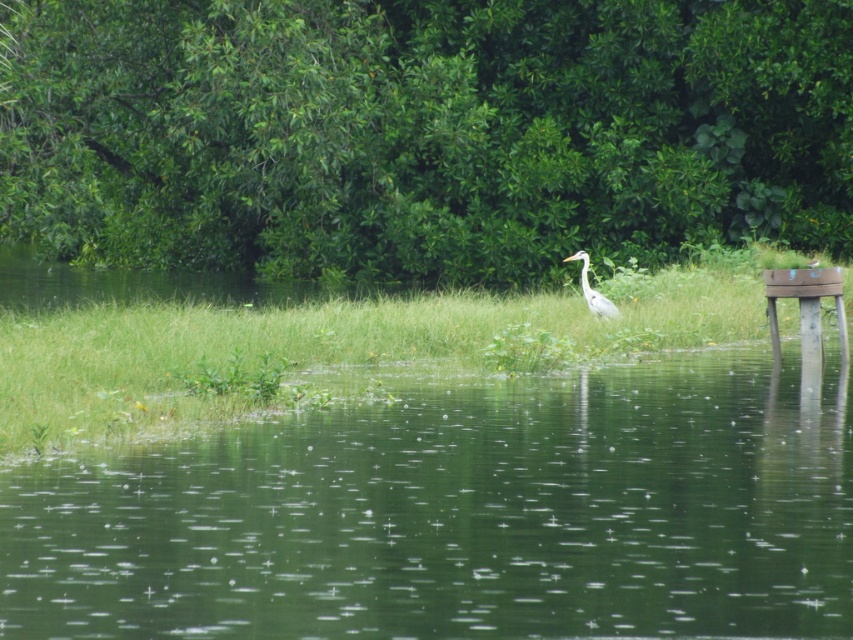
From the picture: Between green leafy tree at center and green grass at center, which one has less height?

green grass at center is shorter.

Is green leafy tree at center bigger than green grass at center?

Correct, green leafy tree at center is larger in size than green grass at center.

This screenshot has height=640, width=853. I want to click on green leafy tree at center, so click(422, 132).

Does green grass at center lie in front of white smooth heron at center?

Yes, green grass at center is in front of white smooth heron at center.

Does green grass at center appear on the left side of white smooth heron at center?

Correct, you'll find green grass at center to the left of white smooth heron at center.

From the picture: Who is more forward, (189,330) or (593,291)?

Point (189,330) is in front.

You are a GUI agent. You are given a task and a screenshot of the screen. Output one action in this format:
    pyautogui.click(x=<x>, y=<y>)
    Task: Click on the green grass at center
    The image size is (853, 640).
    Given the screenshot: What is the action you would take?
    click(328, 349)

Is green leafy tree at center behind white smooth heron at center?

Yes, it is behind white smooth heron at center.

Can you confirm if green leafy tree at center is positioned to the right of white smooth heron at center?

No, green leafy tree at center is not to the right of white smooth heron at center.

Locate an element on the screen. The image size is (853, 640). green leafy tree at center is located at coordinates (422, 132).